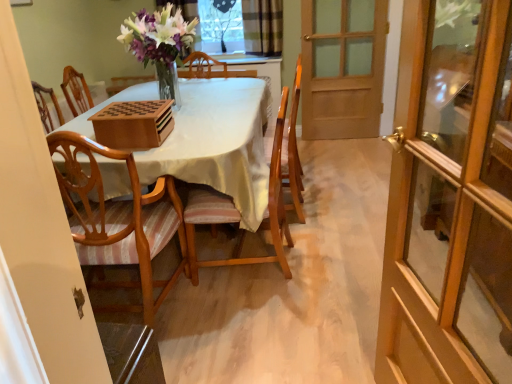
Question: Is light brown wood chair at left, which is the 1th chair from left to right, positioned in front of clear glass window at upper center?

Choices:
 (A) yes
 (B) no

Answer: (A)

Question: Is clear glass window at upper center inside light brown wood chair at left, which is the 1th chair from left to right?

Choices:
 (A) no
 (B) yes

Answer: (A)

Question: Can you confirm if light brown wood chair at left, which is the 1th chair from left to right, is bigger than clear glass window at upper center?

Choices:
 (A) yes
 (B) no

Answer: (A)

Question: Considering the relative positions of light brown wood chair at left, the 2th chair when ordered from right to left, and clear glass window at upper center in the image provided, is light brown wood chair at left, the 2th chair when ordered from right to left, to the left of clear glass window at upper center from the viewer's perspective?

Choices:
 (A) yes
 (B) no

Answer: (A)

Question: Is light brown wood chair at left, which is the 1th chair from left to right, with clear glass window at upper center?

Choices:
 (A) yes
 (B) no

Answer: (B)

Question: From a real-world perspective, is light brown wood chair at left, the 2th chair when ordered from right to left, on top of clear glass window at upper center?

Choices:
 (A) no
 (B) yes

Answer: (A)

Question: Is wooden glass door at right, arranged as the 1th door when viewed from the front, closer to camera compared to plaid fabric curtain at upper center?

Choices:
 (A) yes
 (B) no

Answer: (A)

Question: Are wooden glass door at right, the first door positioned from the bottom, and plaid fabric curtain at upper center far apart?

Choices:
 (A) yes
 (B) no

Answer: (A)

Question: Can you confirm if wooden glass door at right, the first door positioned from the bottom, is positioned to the right of plaid fabric curtain at upper center?

Choices:
 (A) yes
 (B) no

Answer: (A)

Question: From a real-world perspective, is wooden glass door at right, arranged as the 1th door when viewed from the front, under plaid fabric curtain at upper center?

Choices:
 (A) yes
 (B) no

Answer: (A)

Question: From a real-world perspective, is wooden glass door at right, which is counted as the 2th door, starting from the top, located higher than plaid fabric curtain at upper center?

Choices:
 (A) yes
 (B) no

Answer: (B)

Question: Is wooden glass door at right, arranged as the 1th door when viewed from the front, bigger than plaid fabric curtain at upper center?

Choices:
 (A) no
 (B) yes

Answer: (B)

Question: Does clear glass window at upper center have a lesser width compared to wooden door at right, the 1th door viewed from the back?

Choices:
 (A) yes
 (B) no

Answer: (B)